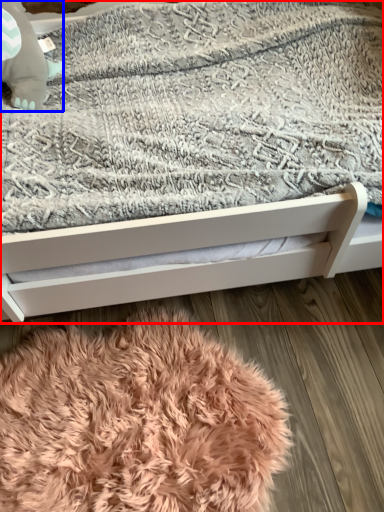
Question: Among these objects, which one is farthest to the camera, bed (highlighted by a red box) or baby elephant (highlighted by a blue box)?

Choices:
 (A) bed
 (B) baby elephant

Answer: (B)